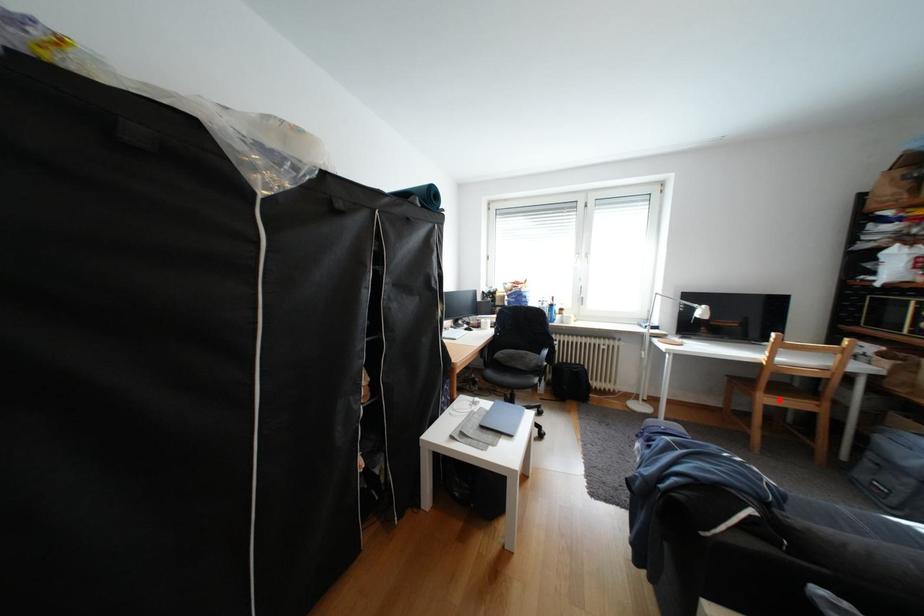
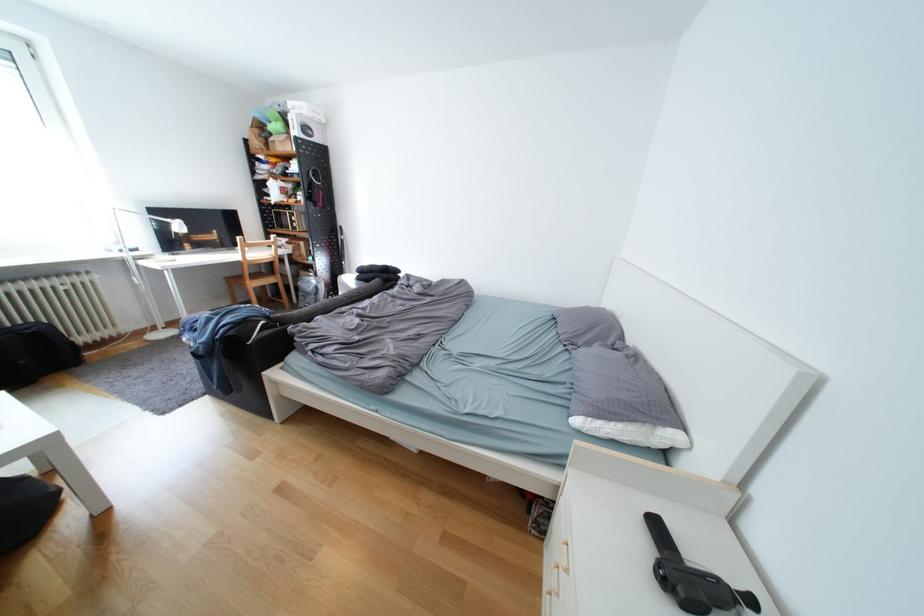
Question: I am providing you with two images of the same scene from different viewpoints. A red point is shown in image1. For the corresponding object point in image2, is it positioned nearer or farther from the camera?

Choices:
 (A) Nearer
 (B) Farther

Answer: (A)